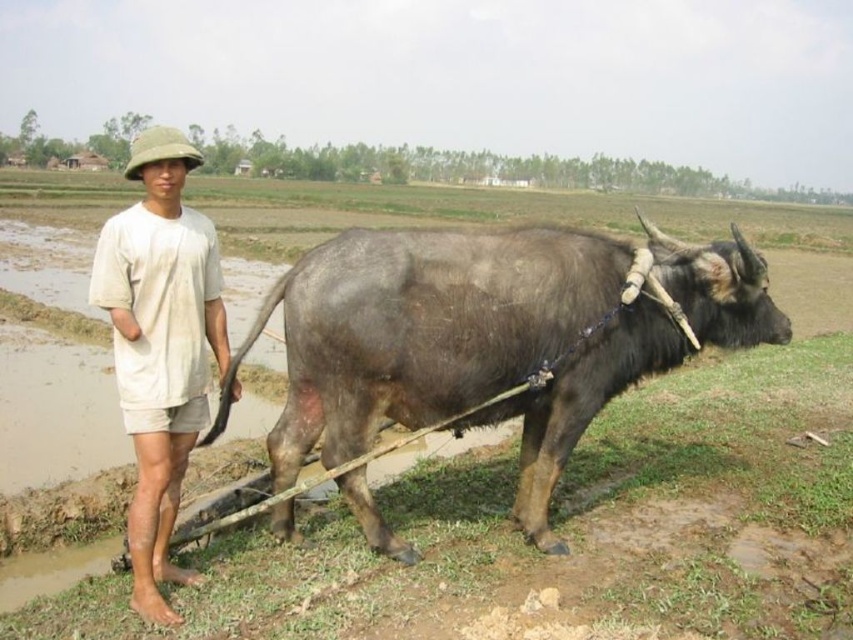
Question: Can you confirm if dark gray textured bull at right is positioned below light beige cotton shirt at left?

Choices:
 (A) yes
 (B) no

Answer: (B)

Question: Among these points, which one is farthest from the camera?

Choices:
 (A) (328, 305)
 (B) (189, 397)

Answer: (A)

Question: Is dark gray textured bull at right in front of light beige cotton shirt at left?

Choices:
 (A) yes
 (B) no

Answer: (B)

Question: Can you confirm if dark gray textured bull at right is wider than light beige cotton shirt at left?

Choices:
 (A) no
 (B) yes

Answer: (B)

Question: Among these objects, which one is farthest from the camera?

Choices:
 (A) dark gray textured bull at right
 (B) light beige cotton shirt at left

Answer: (A)